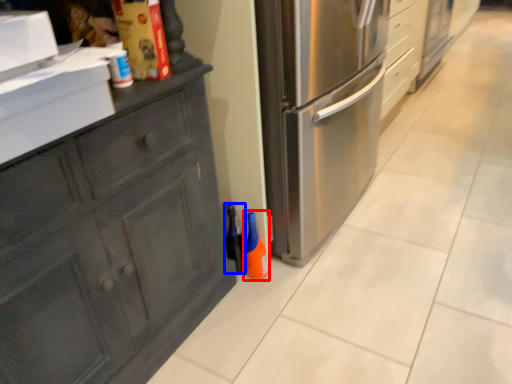
Question: Which of the following is the closest to the observer, bottle (highlighted by a red box) or bottle (highlighted by a blue box)?

Choices:
 (A) bottle
 (B) bottle

Answer: (A)